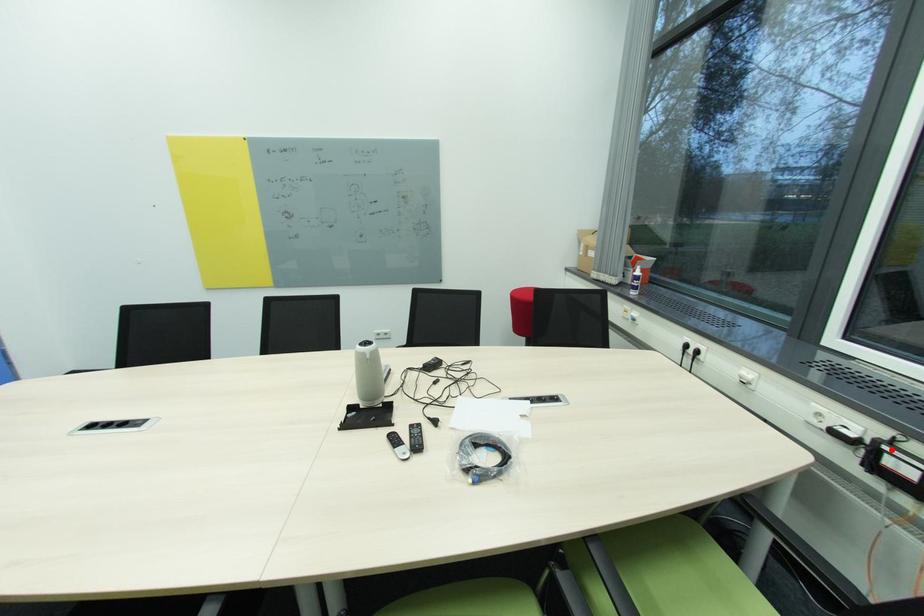
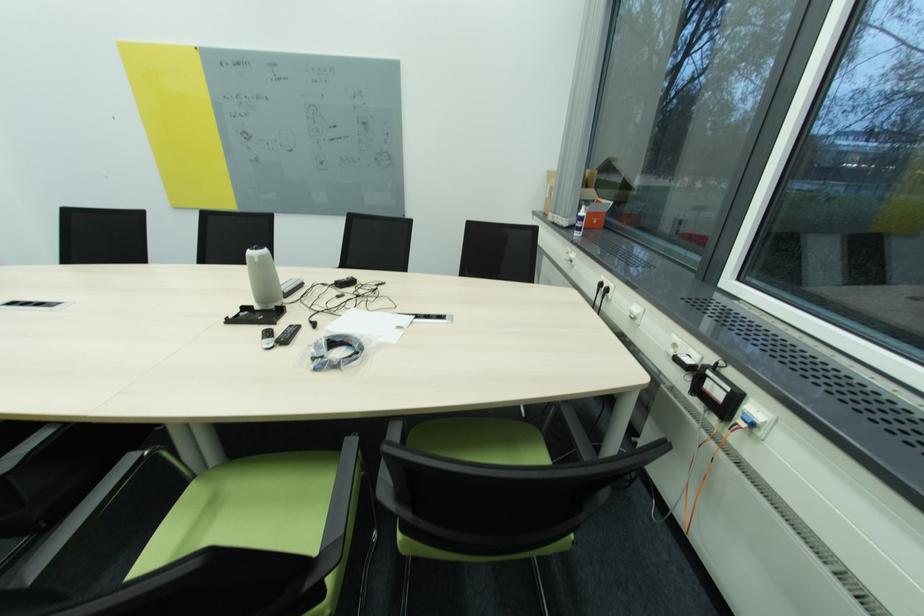
Locate, in the second image, the point that corresponds to the highlighted location in the first image.

(713, 373)